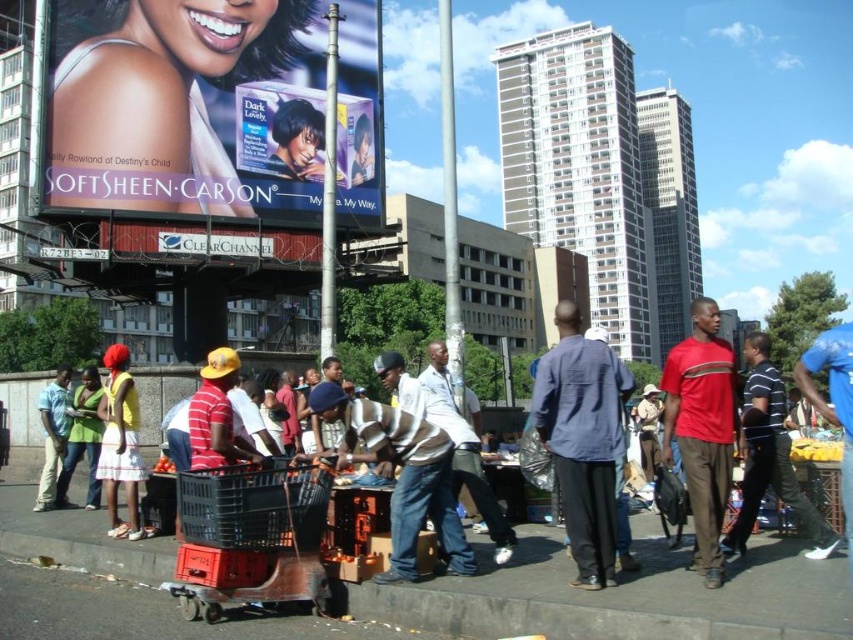
Question: Observing the image, what is the correct spatial positioning of matte plastic billboard at upper left in reference to black plastic trolley at center?

Choices:
 (A) right
 (B) left

Answer: (B)

Question: Can you confirm if black plastic trolley at center is positioned above matte yellow dress at center?

Choices:
 (A) no
 (B) yes

Answer: (A)

Question: Is red matte shirt at right in front of light blue denim jeans at lower left?

Choices:
 (A) yes
 (B) no

Answer: (A)

Question: Which object appears closest to the camera in this image?

Choices:
 (A) matte yellow dress at center
 (B) matte plastic poster at upper center
 (C) striped cotton shirt at center
 (D) light blue denim jeans at lower left

Answer: (C)

Question: Which of these objects is positioned closest to the red matte shirt at right?

Choices:
 (A) matte yellow dress at center
 (B) matte plastic poster at upper center

Answer: (A)

Question: Among these points, which one is nearest to the camera?

Choices:
 (A) [695, 563]
 (B) [335, 161]
 (C) [390, 557]
 (D) [294, 477]

Answer: (D)